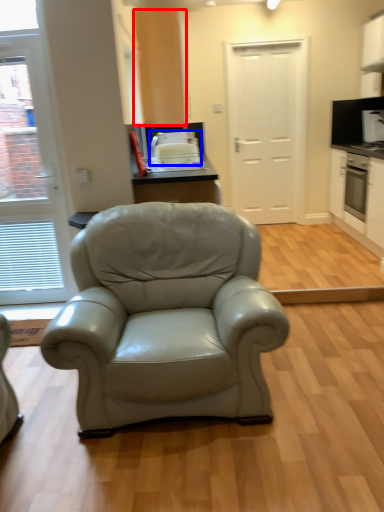
Question: Which point is closer to the camera, cabinetry (highlighted by a red box) or appliance (highlighted by a blue box)?

Choices:
 (A) cabinetry
 (B) appliance

Answer: (A)